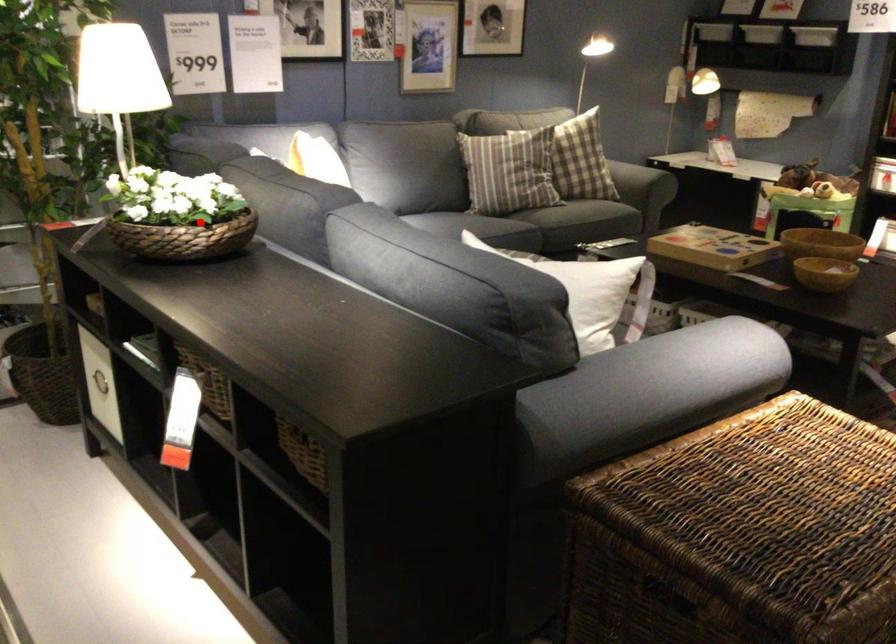
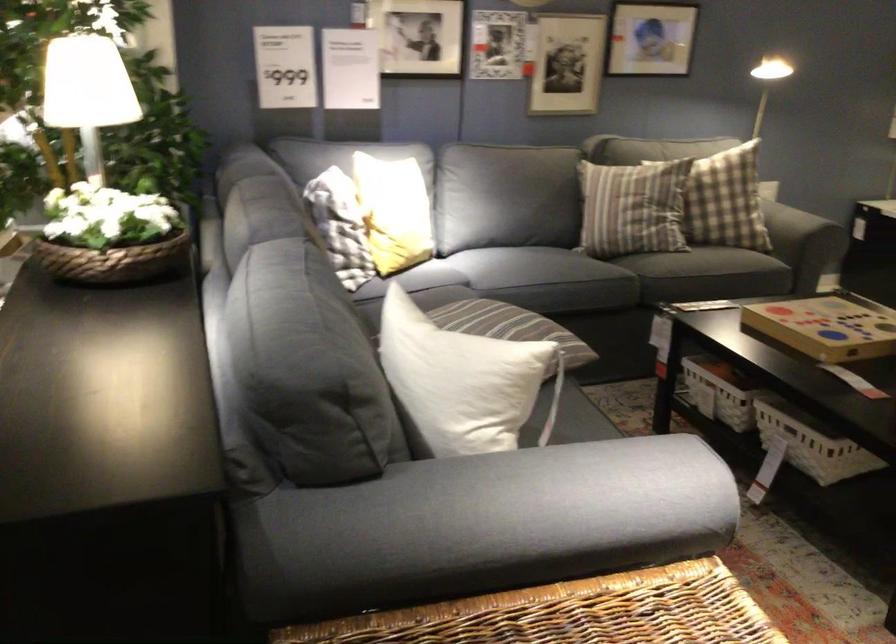
The point at the highlighted location is marked in the first image. Where is the corresponding point in the second image?

(109, 236)